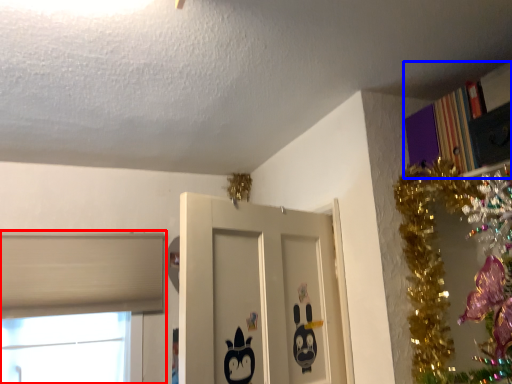
Question: Which object appears farthest to the camera in this image, window (highlighted by a red box) or bookcase (highlighted by a blue box)?

Choices:
 (A) window
 (B) bookcase

Answer: (A)